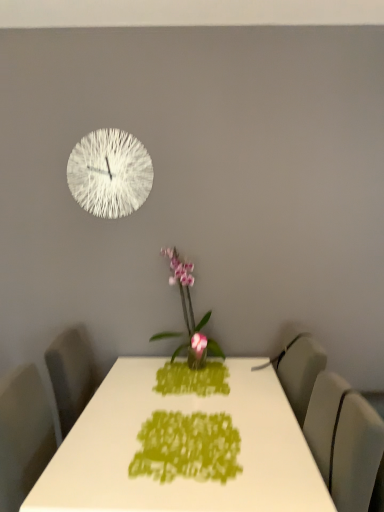
Where is `matte gray swivel chair at right`? matte gray swivel chair at right is located at coordinates (355, 453).

Identify the location of pink glossy orchid at center. (190, 314).

Find the location of `white glossy table at center`. white glossy table at center is located at coordinates (184, 444).

The image size is (384, 512). Describe the element at coordinates (184, 444) in the screenshot. I see `white glossy table at center` at that location.

You are a GUI agent. You are given a task and a screenshot of the screen. Output one action in this format:
    pyautogui.click(x=<x>, y=<y>)
    Task: Click on the green fabric placemat at center
    The image size is (384, 512).
    Given the screenshot: What is the action you would take?
    pyautogui.click(x=187, y=447)

Is green fabric placemat at center further to the viewer compared to white glossy table at center?

Yes, green fabric placemat at center is further from the camera.

Is green fabric placemat at center placed right next to white glossy table at center?

Yes, green fabric placemat at center is right next to white glossy table at center and making contact.

Image resolution: width=384 pixels, height=512 pixels. Identify the location of table below the green fabric placemat at center (from the image's perspective). (184, 444).

Looking at this image, based on their positions, is green fabric placemat at center located to the left or right of white glossy table at center?

In the image, green fabric placemat at center appears on the right side of white glossy table at center.

Does matte gray swivel chair at right have a larger size compared to white glossy table at center?

No.

Which of these two, matte gray swivel chair at right or white glossy table at center, is wider?

white glossy table at center.

Is white glossy table at center completely or partially inside matte gray swivel chair at right?

No.

Which is more to the left, matte gray swivel chair at right or white glossy table at center?

Positioned to the left is white glossy table at center.

Can you confirm if white textured clock at upper left is bigger than green fabric placemat at center?

Indeed, white textured clock at upper left has a larger size compared to green fabric placemat at center.

Is white textured clock at upper left located outside green fabric placemat at center?

Yes, white textured clock at upper left is outside of green fabric placemat at center.

Is white textured clock at upper left oriented towards green fabric placemat at center?

No, white textured clock at upper left does not turn towards green fabric placemat at center.

Is green fabric placemat at center closer to the viewer compared to white textured clock at upper left?

That is True.

From the picture: From the image's perspective, between green fabric placemat at center and white textured clock at upper left, which one is located above?

white textured clock at upper left.

Is green fabric placemat at center not within white textured clock at upper left?

Absolutely, green fabric placemat at center is external to white textured clock at upper left.

In the scene shown: Which object is wider, green fabric placemat at center or white textured clock at upper left?

With larger width is green fabric placemat at center.

From the image's perspective, is pink glossy orchid at center located beneath white textured clock at upper left?

Yes.

Consider the image. Is pink glossy orchid at center facing towards white textured clock at upper left?

No, pink glossy orchid at center is not turned towards white textured clock at upper left.

Based on their sizes in the image, would you say pink glossy orchid at center is bigger or smaller than white textured clock at upper left?

pink glossy orchid at center is bigger than white textured clock at upper left.

Can you confirm if pink glossy orchid at center is positioned to the right of green fabric placemat at center?

In fact, pink glossy orchid at center is to the left of green fabric placemat at center.

Choose the correct answer: Is pink glossy orchid at center inside green fabric placemat at center or outside it?

pink glossy orchid at center cannot be found inside green fabric placemat at center.

Is point (186, 309) positioned after point (172, 426)?

That is True.

Measure the distance from green fabric placemat at center to matte gray swivel chair at right.

The distance of green fabric placemat at center from matte gray swivel chair at right is 15.74 inches.

In terms of width, does green fabric placemat at center look wider or thinner when compared to matte gray swivel chair at right?

In the image, green fabric placemat at center appears to be wider than matte gray swivel chair at right.

Which is closer, (155, 461) or (344, 437)?

Point (155, 461) is farther from the camera than point (344, 437).

Is matte gray swivel chair at right a part of green fabric placemat at center?

No, matte gray swivel chair at right is not surrounded by green fabric placemat at center.

Image resolution: width=384 pixels, height=512 pixels. What are the coordinates of `table beneath the green fabric placemat at center (from a real-world perspective)` in the screenshot? It's located at (184, 444).

What are the coordinates of `table lying on the left of matte gray swivel chair at right` in the screenshot? It's located at (184, 444).

In the scene shown: Estimate the real-world distances between objects in this image. Which object is further from green fabric placemat at center, pink glossy orchid at center or matte gray swivel chair at right?

pink glossy orchid at center is positioned further to the anchor green fabric placemat at center.

Based on their spatial positions, is matte gray swivel chair at right or white textured clock at upper left closer to green fabric placemat at center?

matte gray swivel chair at right is closer to green fabric placemat at center.

Looking at the image, which one is located further to white textured clock at upper left, matte gray swivel chair at right or pink glossy orchid at center?

Among the two, matte gray swivel chair at right is located further to white textured clock at upper left.

From the image, which object appears to be farther from white glossy table at center, white textured clock at upper left or pink glossy orchid at center?

white textured clock at upper left.

Looking at the image, which one is located closer to matte gray swivel chair at right, green fabric placemat at center or white glossy table at center?

white glossy table at center lies closer to matte gray swivel chair at right than the other object.

Considering their positions, is pink glossy orchid at center positioned further to white glossy table at center than green fabric placemat at center?

pink glossy orchid at center is positioned further to the anchor white glossy table at center.

When comparing their distances from pink glossy orchid at center, does green fabric placemat at center or matte gray swivel chair at right seem closer?

green fabric placemat at center is closer to pink glossy orchid at center.

In the scene shown: Based on their spatial positions, is green fabric placemat at center or white glossy table at center further from white textured clock at upper left?

green fabric placemat at center is further to white textured clock at upper left.

This screenshot has width=384, height=512. I want to click on design between white glossy table at center and matte gray swivel chair at right, so click(187, 447).

Where is `design positioned between white glossy table at center and pink glossy orchid at center from near to far`? The image size is (384, 512). design positioned between white glossy table at center and pink glossy orchid at center from near to far is located at coordinates (187, 447).

I want to click on design between matte gray swivel chair at right and white textured clock at upper left from front to back, so click(187, 447).

Image resolution: width=384 pixels, height=512 pixels. In order to click on houseplant located between matte gray swivel chair at right and white textured clock at upper left in the depth direction in this screenshot , I will do `click(190, 314)`.